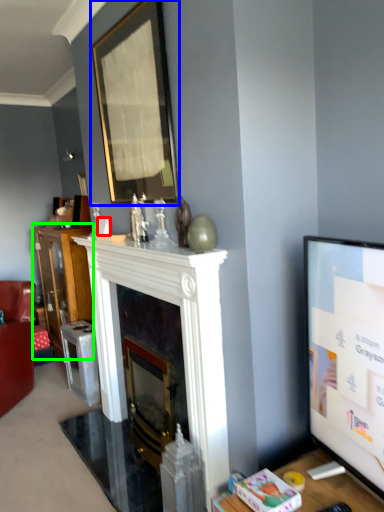
Question: Based on their relative distances, which object is nearer to coffee cup (highlighted by a red box)? Choose from picture frame (highlighted by a blue box) and cabinetry (highlighted by a green box).

Choices:
 (A) picture frame
 (B) cabinetry

Answer: (A)